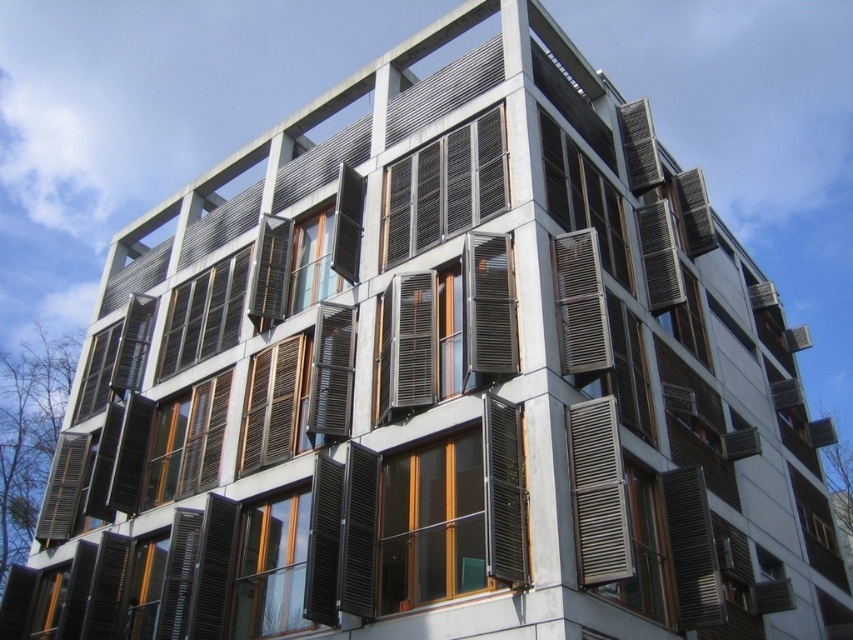
Question: Is metallic gray shutters at center behind matte wood shutter at center?

Choices:
 (A) yes
 (B) no

Answer: (A)

Question: Is metallic silver shutter at lower right further to the viewer compared to wooden window at center?

Choices:
 (A) yes
 (B) no

Answer: (B)

Question: Which point appears farthest from the camera in this image?

Choices:
 (A) (584, 308)
 (B) (421, 248)

Answer: (B)

Question: Among these objects, which one is farthest from the camera?

Choices:
 (A) metallic silver shutter at lower right
 (B) metallic silver shutter at center
 (C) metallic silver shutters at center
 (D) matte black shutter at center

Answer: (D)

Question: Which of the following is the closest to the observer?

Choices:
 (A) (566, 333)
 (B) (210, 445)
 (C) (595, 460)

Answer: (C)

Question: Can you confirm if wooden window at center is positioned to the right of metallic silver shutter at center?

Choices:
 (A) no
 (B) yes

Answer: (A)